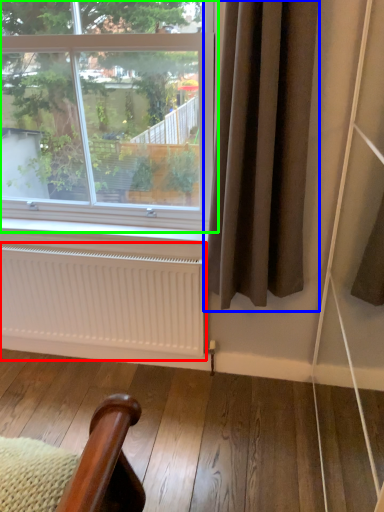
Question: Estimate the real-world distances between objects in this image. Which object is closer to radiator (highlighted by a red box), curtain (highlighted by a blue box) or window (highlighted by a green box)?

Choices:
 (A) curtain
 (B) window

Answer: (A)